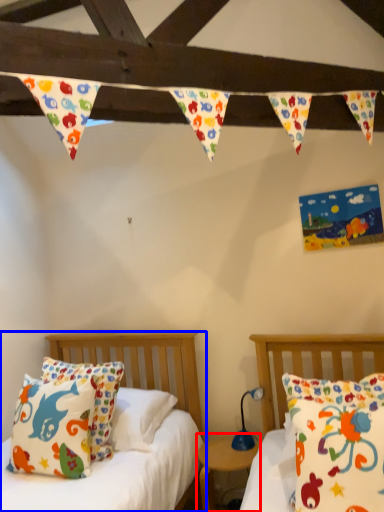
Question: Which point is further to the camera, nightstand (highlighted by a red box) or bed (highlighted by a blue box)?

Choices:
 (A) nightstand
 (B) bed

Answer: (A)